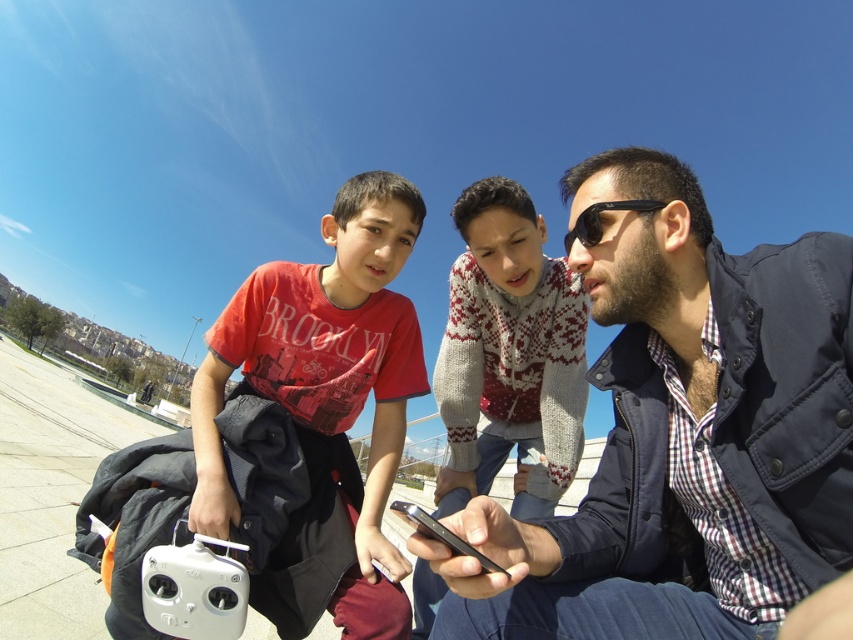
You are a photographer trying to capture a candid shot of the two boys in the scene. You notice the knitted sweater at center and the black matte smartphone at center. Which object is closer to the camera lens? Please explain based on their positions.

The knitted sweater at center is not as tall as the black matte smartphone at center, which suggests that the knitted sweater at center is closer to the camera lens since objects closer to the lens appear larger in the photo.

You are a photographer trying to capture a candid shot of the two boys and the adult male. You notice the dark blue jacket at center and the black plastic sunglasses at center in the scene. Which object should you avoid blocking to ensure the subjects remain visible in your photo?

The dark blue jacket at center is below the black plastic sunglasses at center, so you should avoid blocking the black plastic sunglasses at center to keep the subjects visible.